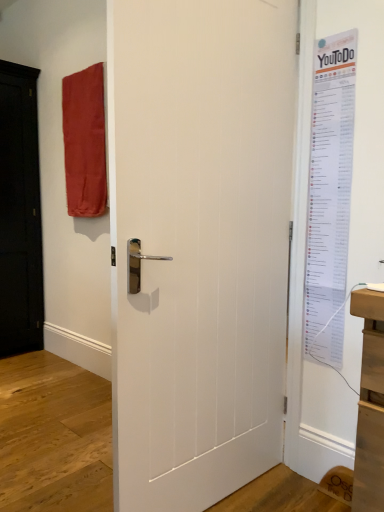
Locate an element on the screen. The image size is (384, 512). white matte door at center is located at coordinates (200, 244).

This screenshot has width=384, height=512. Describe the element at coordinates (329, 196) in the screenshot. I see `white paper poster at right` at that location.

Identify the location of white matte door at center. The height and width of the screenshot is (512, 384). (200, 244).

From the picture: Is white paper poster at right facing away from matte red fabric at upper left?

No, matte red fabric at upper left is not at the back of white paper poster at right.

Can we say white paper poster at right lies outside matte red fabric at upper left?

Yes, white paper poster at right is located beyond the bounds of matte red fabric at upper left.

Is white paper poster at right not close to matte red fabric at upper left?

Indeed, white paper poster at right is not near matte red fabric at upper left.

Is white matte door at center positioned with its back to matte red fabric at upper left?

Yes, matte red fabric at upper left is at the back of white matte door at center.

Is white matte door at center thinner than matte red fabric at upper left?

Yes.

This screenshot has width=384, height=512. What are the coordinates of `door lying in front of the matte red fabric at upper left` in the screenshot? It's located at (200, 244).

Does white matte door at center have a smaller size compared to matte red fabric at upper left?

Incorrect, white matte door at center is not smaller in size than matte red fabric at upper left.

Which point is more distant from viewer, (317, 183) or (126, 216)?

The point (317, 183) is behind.

From the picture: Is white paper poster at right surrounding white matte door at center?

No, white matte door at center is not surrounded by white paper poster at right.

How different are the orientations of white paper poster at right and white matte door at center in degrees?

86.6 degrees separate the facing orientations of white paper poster at right and white matte door at center.

Who is taller, white paper poster at right or white matte door at center?

With more height is white matte door at center.

Does matte red fabric at upper left have a greater width compared to white paper poster at right?

Correct, the width of matte red fabric at upper left exceeds that of white paper poster at right.

Between matte red fabric at upper left and white paper poster at right, which one is positioned in front?

Positioned in front is white paper poster at right.

Is white paper poster at right at the back of matte red fabric at upper left?

No, matte red fabric at upper left's orientation is not away from white paper poster at right.

Is point (186, 327) more distant than point (322, 227)?

No, it is not.

You are a GUI agent. You are given a task and a screenshot of the screen. Output one action in this format:
    pyautogui.click(x=<x>, y=<y>)
    Task: Click on the door below the white paper poster at right (from a real-world perspective)
    
    Given the screenshot: What is the action you would take?
    pyautogui.click(x=200, y=244)

Is white matte door at center far away from white paper poster at right?

No, white matte door at center is not far away from white paper poster at right.

Considering the sizes of objects white matte door at center and white paper poster at right in the image provided, who is taller, white matte door at center or white paper poster at right?

white matte door at center.

Which is closer to the camera, (103,214) or (149,240)?

Point (103,214) is farther from the camera than point (149,240).

Considering the relative positions of matte red fabric at upper left and white matte door at center in the image provided, is matte red fabric at upper left to the right of white matte door at center from the viewer's perspective?

Incorrect, matte red fabric at upper left is not on the right side of white matte door at center.

Is matte red fabric at upper left not within white matte door at center?

Yes, matte red fabric at upper left is located beyond the bounds of white matte door at center.

Is matte red fabric at upper left looking in the opposite direction of white matte door at center?

matte red fabric at upper left does not have its back to white matte door at center.

You are a GUI agent. You are given a task and a screenshot of the screen. Output one action in this format:
    pyautogui.click(x=<x>, y=<y>)
    Task: Click on the curtain that appears above the white paper poster at right (from a real-world perspective)
    This screenshot has height=512, width=384.
    Given the screenshot: What is the action you would take?
    pyautogui.click(x=84, y=142)

Find the location of a particular element. This screenshot has width=384, height=512. curtain on the left side of white matte door at center is located at coordinates (84, 142).

Based on their spatial positions, is white paper poster at right or matte red fabric at upper left further from white matte door at center?

matte red fabric at upper left is positioned further to the anchor white matte door at center.

Looking at the image, which one is located further to white paper poster at right, matte red fabric at upper left or white matte door at center?

matte red fabric at upper left is further to white paper poster at right.

In the scene shown: Based on their spatial positions, is white paper poster at right or white matte door at center closer to matte red fabric at upper left?

Based on the image, white matte door at center appears to be nearer to matte red fabric at upper left.

When comparing their distances from matte red fabric at upper left, does white matte door at center or white paper poster at right seem further?

white paper poster at right is further to matte red fabric at upper left.

Estimate the real-world distances between objects in this image. Which object is further from white matte door at center, matte red fabric at upper left or white paper poster at right?

matte red fabric at upper left.

From the image, which object appears to be nearer to white paper poster at right, white matte door at center or matte red fabric at upper left?

white matte door at center.

Find the location of a particular element. The image size is (384, 512). poster page located between white matte door at center and matte red fabric at upper left in the depth direction is located at coordinates (329, 196).